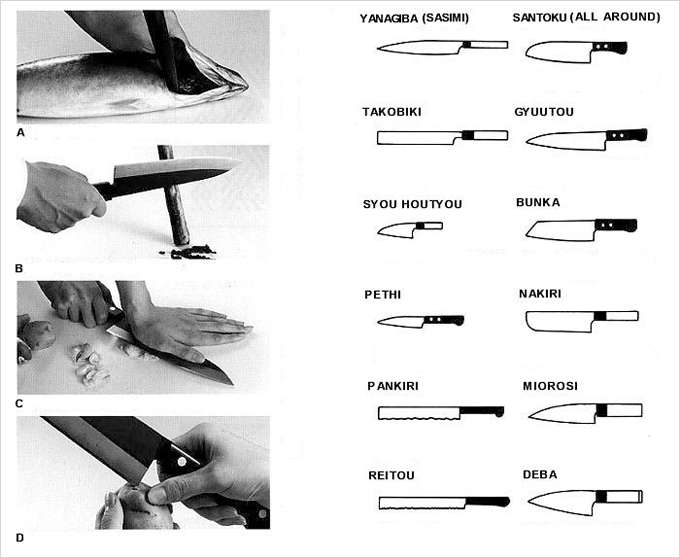
The height and width of the screenshot is (558, 680). I want to click on panel, so click(x=71, y=64), click(x=66, y=171), click(x=64, y=312), click(x=77, y=482).